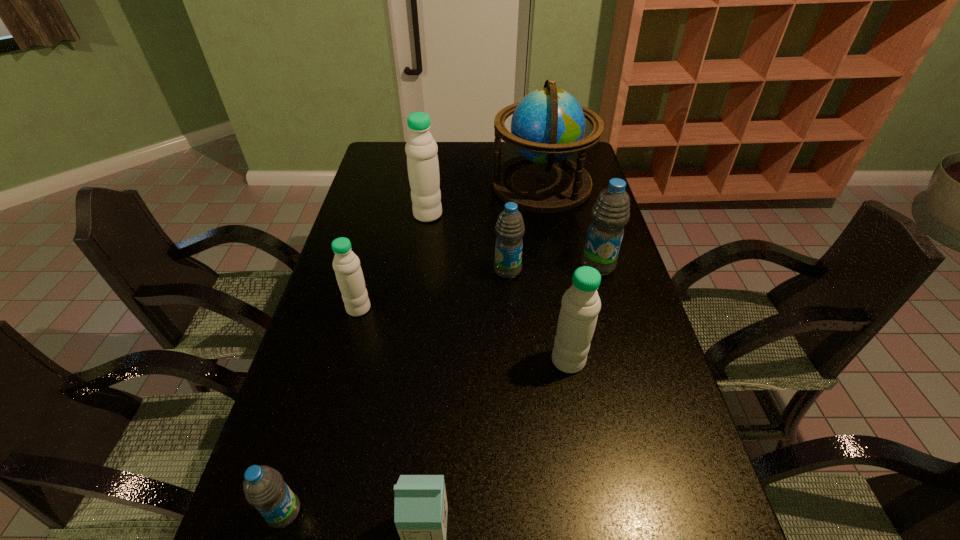
This screenshot has height=540, width=960. What are the coordinates of `globe positioned at the right edge` in the screenshot? It's located at (548, 125).

You are a GUI agent. You are given a task and a screenshot of the screen. Output one action in this format:
    pyautogui.click(x=<x>, y=<y>)
    Task: Click on the water bottle that is at the right edge
    The image size is (960, 540).
    Given the screenshot: What is the action you would take?
    pyautogui.click(x=610, y=213)

This screenshot has height=540, width=960. I want to click on object that is at the far right corner, so click(x=548, y=125).

The image size is (960, 540). I want to click on vacant space at the left edge of the desktop, so click(x=368, y=281).

Find the location of a particular element. The image size is (960, 540). vacant region at the right edge of the desktop is located at coordinates (648, 350).

At what (x,y) coordinates should I click in order to perform the action: click on vacant area that lies between the fourth nearest water bottle and the globe. Please return your answer as a coordinate pair (x, y). Image resolution: width=960 pixels, height=540 pixels. Looking at the image, I should click on (450, 246).

The image size is (960, 540). Find the location of `free space between the globe and the smallest blue water bottle`. free space between the globe and the smallest blue water bottle is located at coordinates (413, 348).

Find the location of a particular element. This screenshot has width=960, height=540. free space between the globe and the nearest blue water bottle is located at coordinates (413, 348).

Where is `empty location between the biggest white water bottle and the globe`? empty location between the biggest white water bottle and the globe is located at coordinates (485, 199).

At what (x,y) coordinates should I click in order to perform the action: click on object that is the eighth closest one to the leftmost blue water bottle. Please return your answer as a coordinate pair (x, y). The width and height of the screenshot is (960, 540). Looking at the image, I should click on pyautogui.click(x=548, y=125).